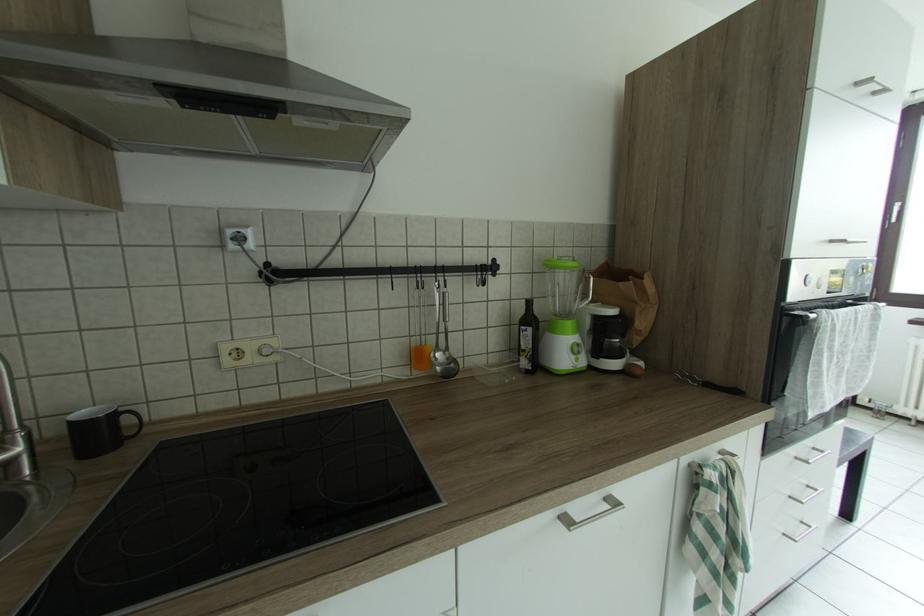
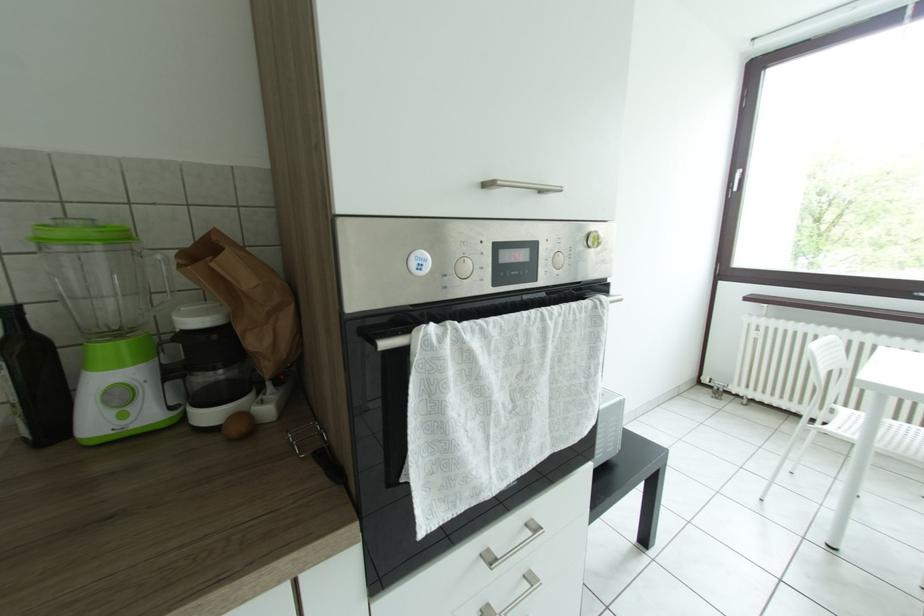
What movement of the cameraman would produce the second image?

The cameraman walked toward right, forward.